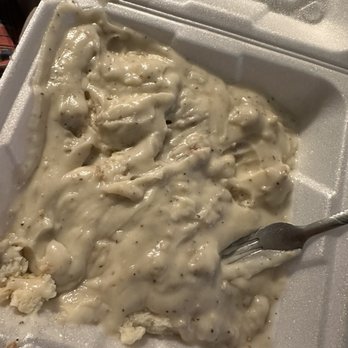
I want to click on fork, so click(275, 234).